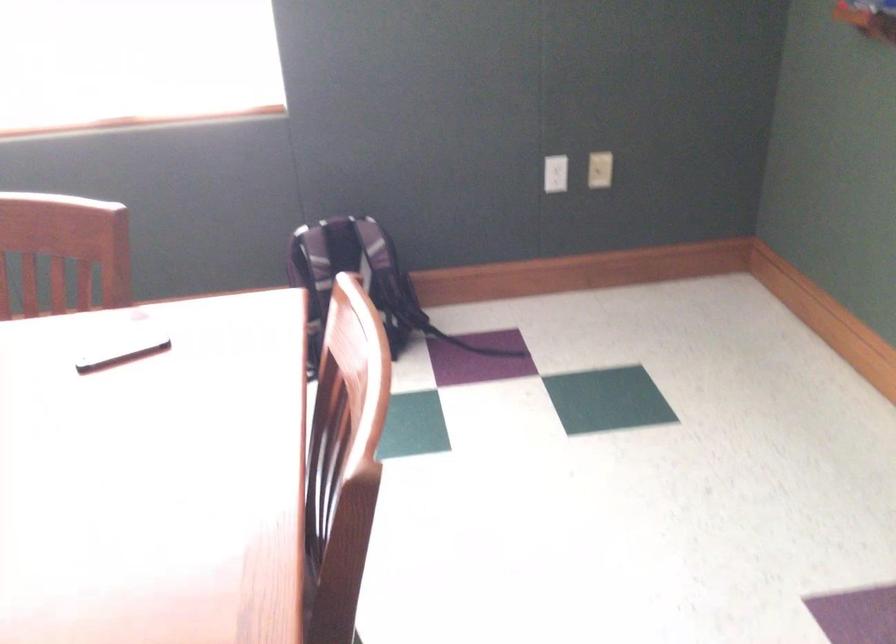
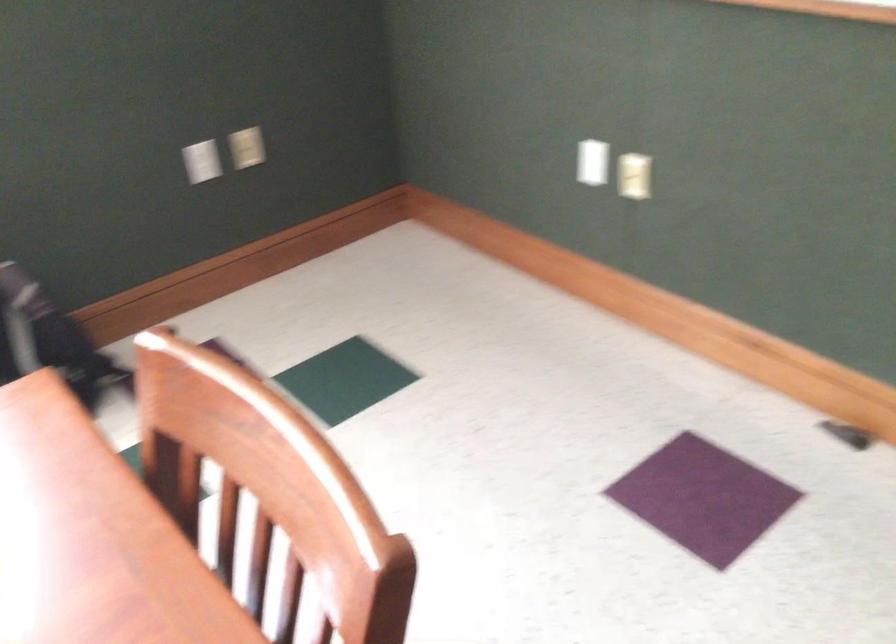
Question: The camera is either moving clockwise (left) or counter-clockwise (right) around the object. The first image is from the beginning of the video and the second image is from the end. Is the camera moving left or right when shooting the video?

Choices:
 (A) Left
 (B) Right

Answer: (A)